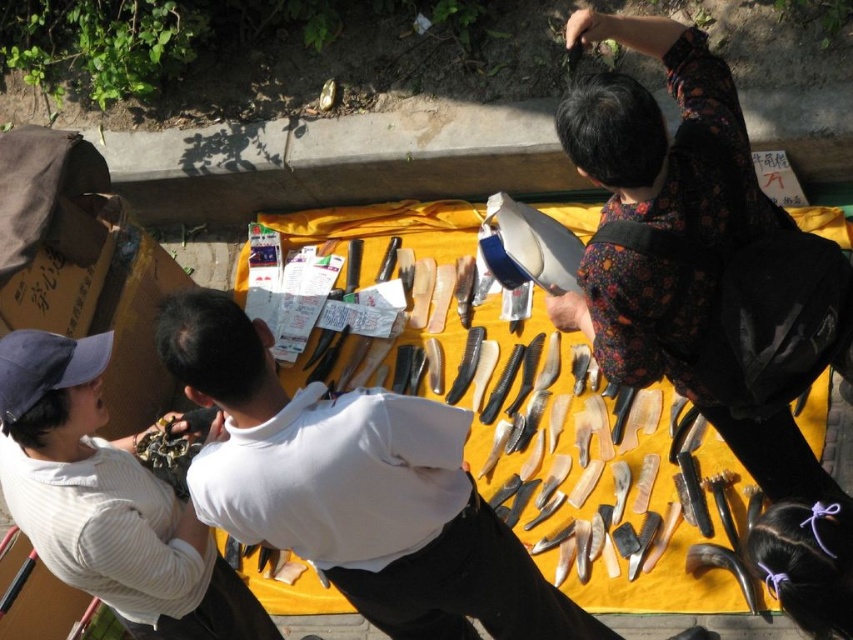
Where is the white matte shirt at center located in the image?

The white matte shirt at center is located at point (355, 488) in the image.

You are a customer at the market and want to know which item is taller between the white matte shirt at center and the black leather shoe at lower right. Can you tell me which one is taller?

The white matte shirt at center is taller than the black leather shoe at lower right according to the description.